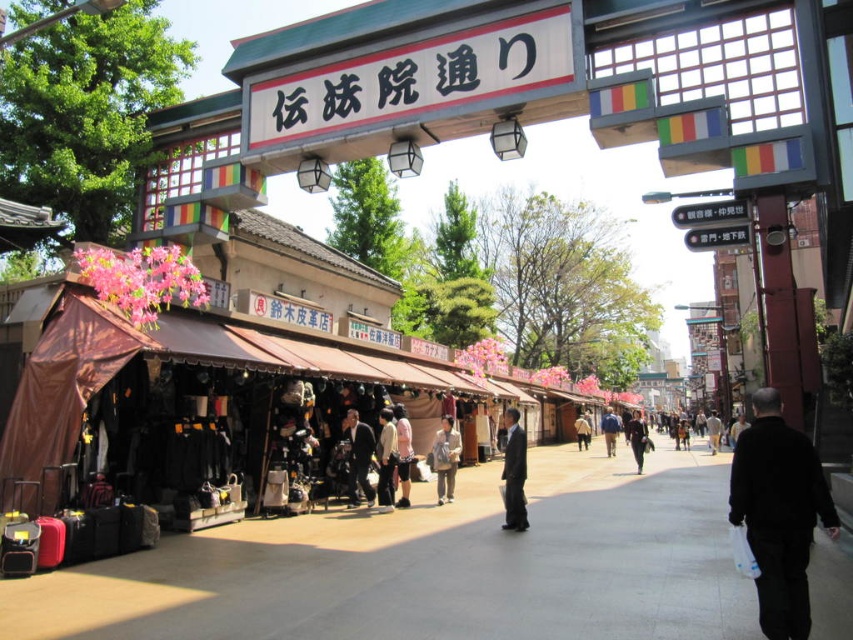
You are a customer browsing the stalls at Denjyoin Street market. You see a light brown leather jacket at center and a light beige fabric bag at center. Which item is located to the right of the other?

The light brown leather jacket at center is positioned on the right side of light beige fabric bag at center, so the jacket is to the right of the bag.

You are a tourist walking on the concrete pavement at center in the traditional Japanese market area. You want to pick up the light beige fabric pants at center. Is the pants above or below your current position?

The light beige fabric pants at center is above the concrete pavement at center, so the pants are above your current position.

You are standing at the entrance of Denjjuin Street and want to walk to the center of the street. According to the map, the concrete pavement at center is located at coordinates point 0.886, 0.509. Can you reach the center of the street by walking straight ahead from your current position?

Yes, since the concrete pavement at center is located at point [433,566], walking straight ahead from the entrance should lead you directly to the center of the street.